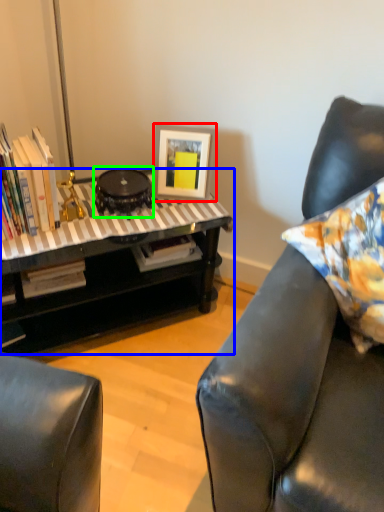
Question: Based on their relative distances, which object is nearer to picture frame (highlighted by a red box)? Choose from table (highlighted by a blue box) and round table (highlighted by a green box).

Choices:
 (A) table
 (B) round table

Answer: (B)